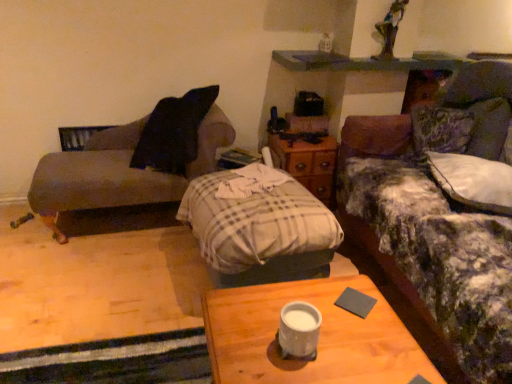
Question: From a real-world perspective, relative to white matte coffee cup at center, is fluffy fabric couch at right, marked as the 1th studio couch in a right-to-left arrangement, vertically above or below?

Choices:
 (A) above
 (B) below

Answer: (B)

Question: Is fluffy fabric couch at right, marked as the 1th studio couch in a right-to-left arrangement, to the left or to the right of white matte coffee cup at center in the image?

Choices:
 (A) right
 (B) left

Answer: (A)

Question: Based on their relative distances, which object is nearer to the wooden desk at center?

Choices:
 (A) plaid fabric pillow at center
 (B) white matte coffee cup at center
 (C) wooden nightstand at center
 (D) fluffy fabric couch at right, marked as the 1th studio couch in a right-to-left arrangement
 (E) matte brown couch at left, which is the second studio couch in right-to-left order

Answer: (B)

Question: Which is nearer to the wooden desk at center?

Choices:
 (A) fluffy fabric couch at right, marked as the 1th studio couch in a right-to-left arrangement
 (B) fluffy white pillow at right
 (C) matte brown couch at left, which is the second studio couch in right-to-left order
 (D) gray matte pad at center
 (E) wooden nightstand at center

Answer: (D)